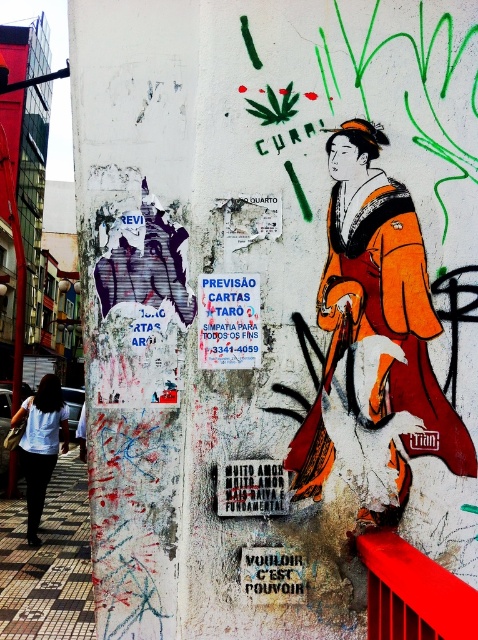
From the picture: You are an artist planning to add a new sticker to the wall. The sticker needs to be placed to the right of the orange silk kimono at center. According to the scene description, where should you position the sticker?

The orange silk kimono at center is located at point (377, 332). To place the sticker to the right of it, you should position it at a coordinate with an x value greater than 0.519 while maintaining the same y value of approximately 0.789.

Based on the scene description, where is the smooth metal rail at lower right located in terms of coordinates?

The smooth metal rail at lower right is located at coordinates point [412,593].

You are a street artist planning to add a new sticker to the wall. You have two spots in mind near the smooth metal rail at lower right and the white cotton shirt at lower left. Considering their sizes, which object would allow you to place a larger sticker without covering the entire surface?

The white cotton shirt at lower left has a larger size compared to the smooth metal rail at lower right, so you can place a larger sticker there without covering the entire surface.